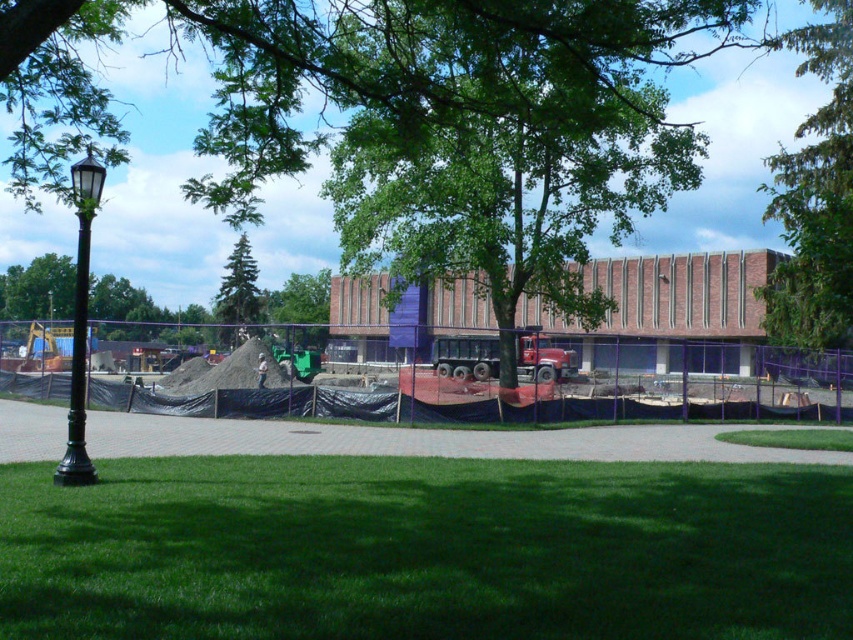
You are a gardener who needs to water the green grass at lower center and the green leafy tree at upper center. Which one should you water first if you want to start from the lowest point in the scene?

The green grass at lower center is located below the green leafy tree at upper center, so you should water the green grass at lower center first as it is lower in elevation.

You are a landscape architect designing a garden. You have to place a new decorative stone path that must be wider than the green grass at lower center but narrower than the black polished metal lamp post at left. Is this possible given the current layout?

The green grass at lower center occupies less space than the black polished metal lamp post at left. Since the path needs to be wider than the grass but narrower than the lamp post, it is possible as there is a size difference between the two.